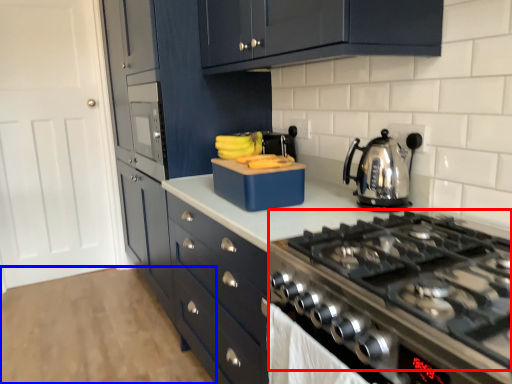
Question: Which point is closer to the camera, gas stove (highlighted by a red box) or plain (highlighted by a blue box)?

Choices:
 (A) gas stove
 (B) plain

Answer: (A)